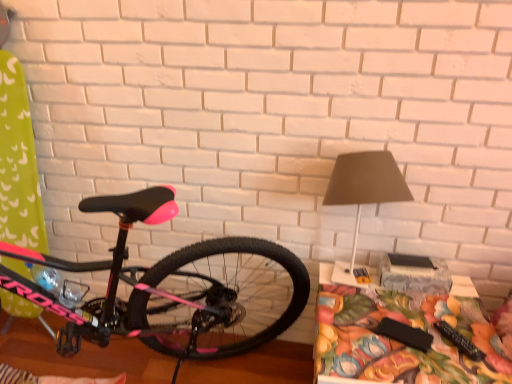
Question: Considering the positions of floral fabric table at lower right and matte gray lampshade at upper right in the image, is floral fabric table at lower right wider or thinner than matte gray lampshade at upper right?

Choices:
 (A) wide
 (B) thin

Answer: (A)

Question: Considering the positions of floral fabric table at lower right and matte gray lampshade at upper right in the image, is floral fabric table at lower right bigger or smaller than matte gray lampshade at upper right?

Choices:
 (A) big
 (B) small

Answer: (A)

Question: Which is nearer to the floral fabric table at lower right?

Choices:
 (A) matte gray lampshade at upper right
 (B) pink matte bicycle at left

Answer: (A)

Question: Considering the real-world distances, which object is farthest from the floral fabric table at lower right?

Choices:
 (A) pink matte bicycle at left
 (B) matte gray lampshade at upper right

Answer: (A)